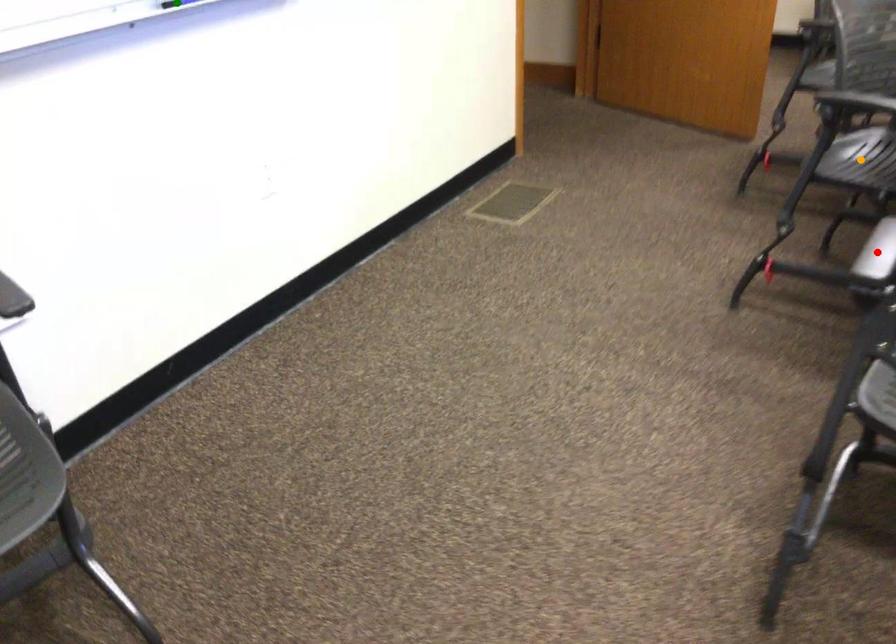
Order these from nearest to farthest:
green point
orange point
red point

red point → green point → orange point